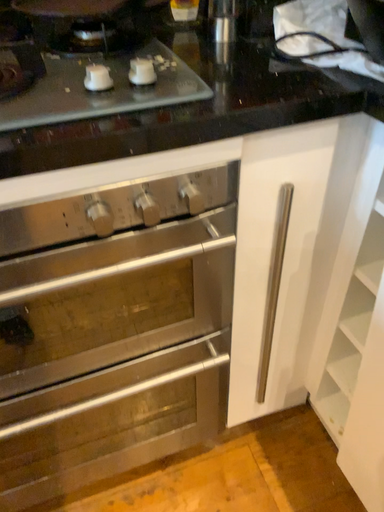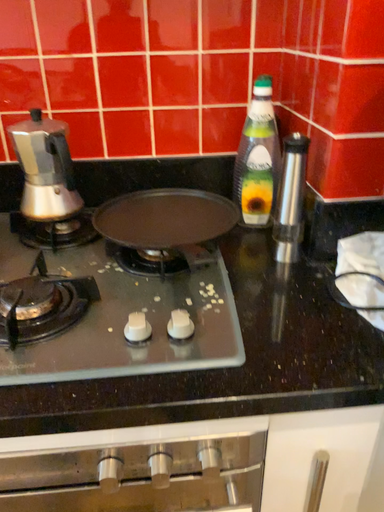
Question: How did the camera likely rotate when shooting the video?

Choices:
 (A) rotated downward
 (B) rotated upward

Answer: (B)